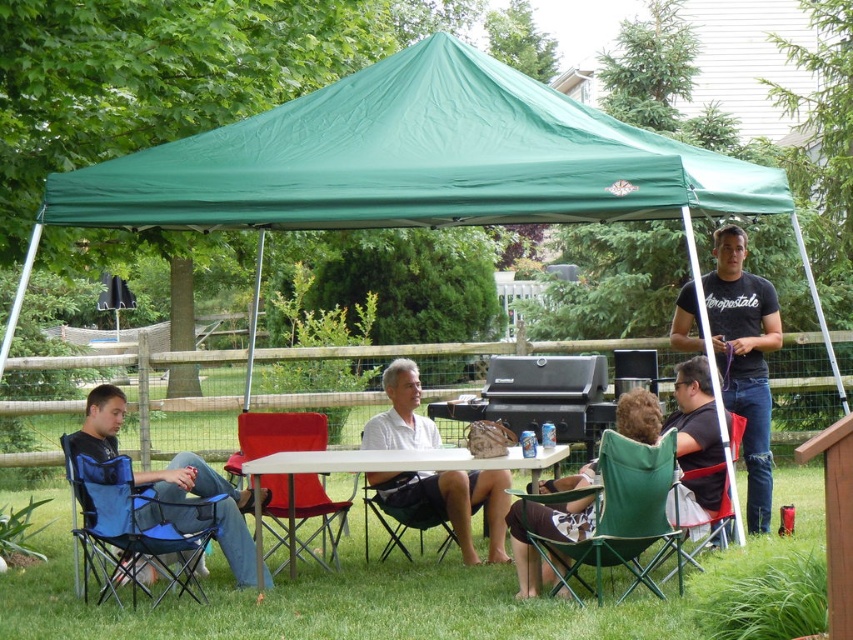
You are at a backyard gathering and need to find a place to sit. You see the white cotton shirt at center and the green fabric chair at lower right. Which object is closer to the left side of the scene?

The white cotton shirt at center is closer to the left side of the scene because it is positioned to the left of the green fabric chair at lower right.

You are standing at the center of the image and want to move to the green fabric chair at lower right. Which direction should you move in to reach it?

You should move to the lower right direction to reach the green fabric chair at lower right since its 2D location is at point (720, 497), which is in the lower right quadrant of the image.